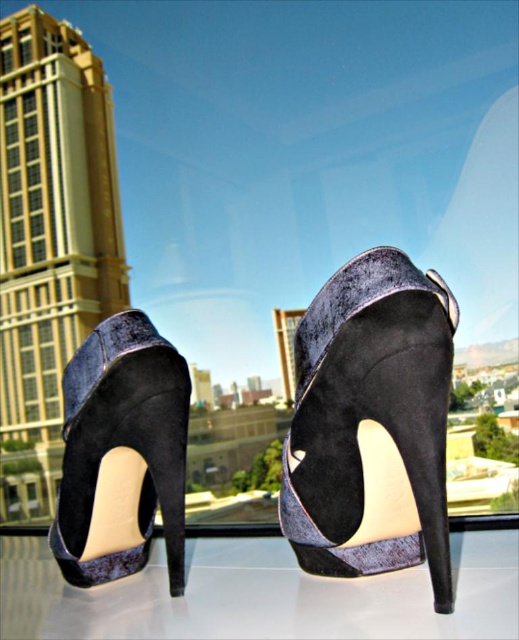
Does velvet-like black high-heeled shoe at center have a greater height compared to velvet black high-heeled shoe at center?

Yes.

From the picture: Is velvet-like black high-heeled shoe at center below velvet black high-heeled shoe at center?

Actually, velvet-like black high-heeled shoe at center is above velvet black high-heeled shoe at center.

Measure the distance between point [415,333] and camera.

Point [415,333] is 47.14 centimeters away from camera.

This screenshot has width=519, height=640. I want to click on velvet-like black high-heeled shoe at center, so click(x=372, y=422).

Is point (463, 589) closer to camera compared to point (172, 433)?

Yes, it is.

The width and height of the screenshot is (519, 640). Identify the location of transparent glass table at center. (260, 595).

Is point (136, 584) less distant than point (144, 541)?

Yes, it is in front of point (144, 541).

Identify the location of transparent glass table at center. (260, 595).

Who is more forward, [294,531] or [340,620]?

Positioned in front is point [340,620].

Is point (399, 566) closer to camera compared to point (147, 604)?

That is True.

Is point (408, 371) more distant than point (375, 618)?

That is False.

This screenshot has height=640, width=519. In order to click on velvet-like black high-heeled shoe at center in this screenshot , I will do `click(372, 422)`.